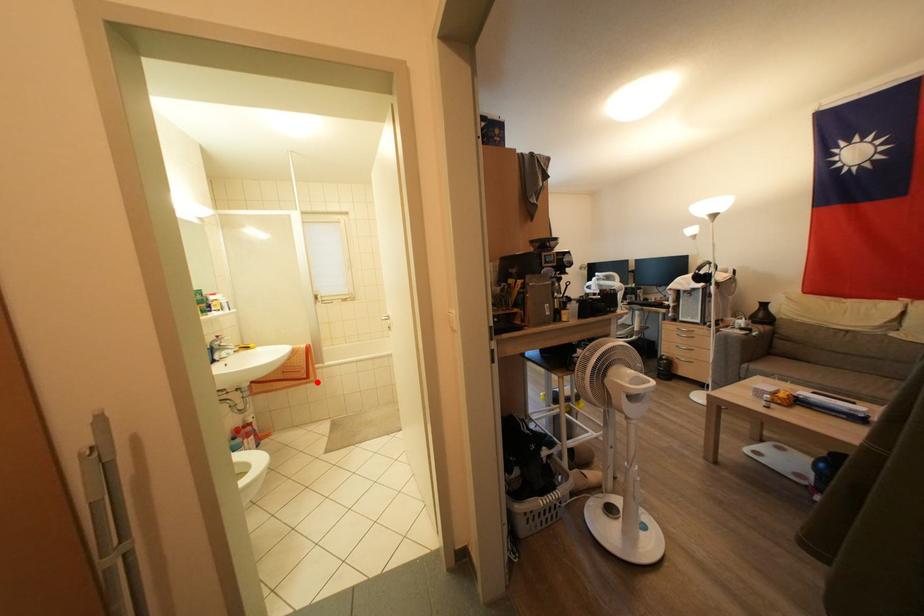
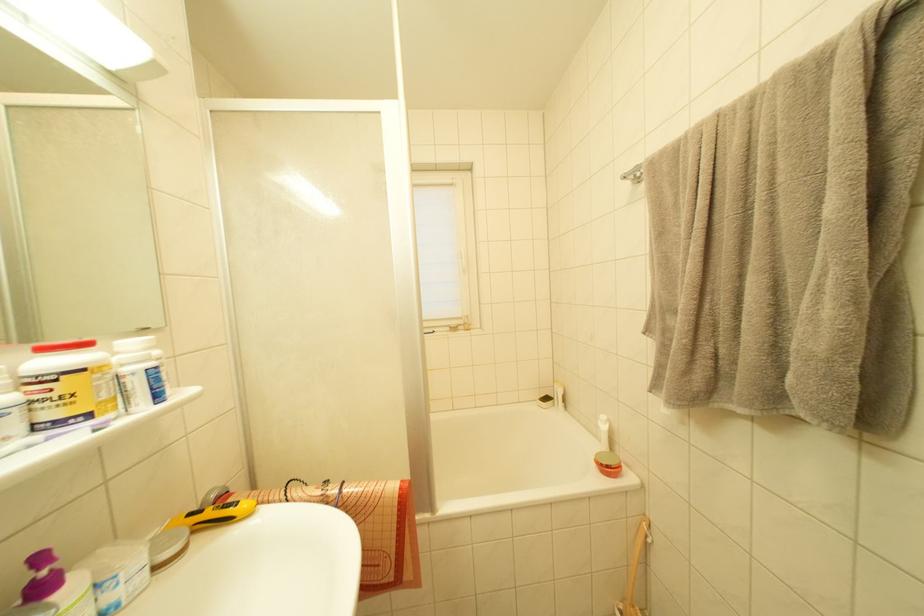
In the second image, find the point that corresponds to the highlighted location in the first image.

(411, 577)